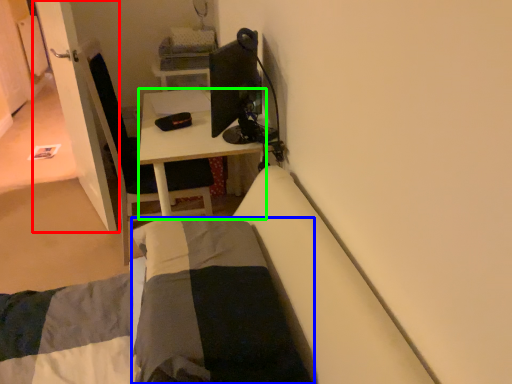
Question: Which object is the farthest from door (highlighted by a red box)? Choose among these: blanket (highlighted by a blue box) or desk (highlighted by a green box).

Choices:
 (A) blanket
 (B) desk

Answer: (A)